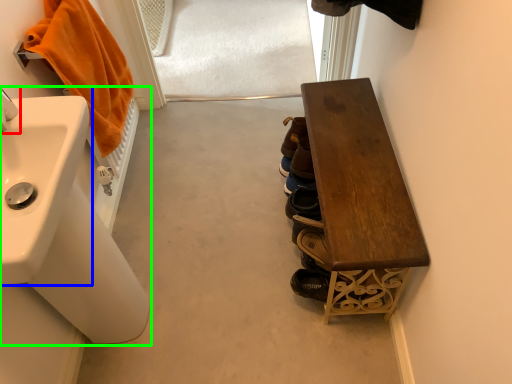
Question: Which object is positioned closest to tap (highlighted by a red box)? Select from sink (highlighted by a blue box) and sink (highlighted by a green box).

Choices:
 (A) sink
 (B) sink

Answer: (A)